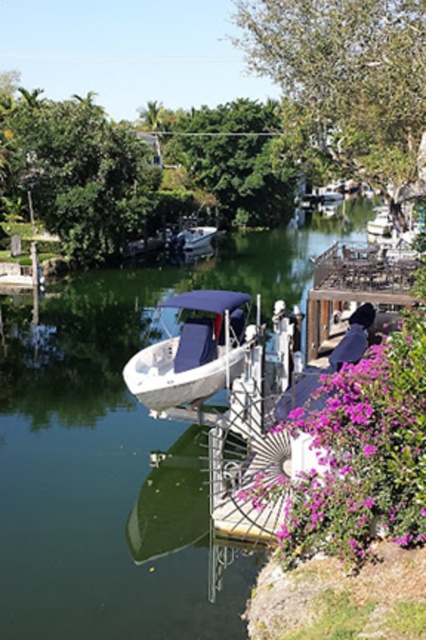
Who is more forward, [304,292] or [173,378]?

Positioned in front is point [173,378].

Identify the location of green smooth water at center. This screenshot has width=426, height=640. (120, 452).

This screenshot has width=426, height=640. Identify the location of green smooth water at center. (120, 452).

Is purple matte flower at lower right taller than white matte boat at center?

Yes.

Which is more to the right, purple matte flower at lower right or white matte boat at center?

purple matte flower at lower right

Find the location of a particular element. The image size is (426, 640). purple matte flower at lower right is located at coordinates (359, 454).

This screenshot has width=426, height=640. What do you see at coordinates (120, 452) in the screenshot? I see `green smooth water at center` at bounding box center [120, 452].

Does green smooth water at center have a larger size compared to purple matte flower at lower right?

Yes, green smooth water at center is bigger than purple matte flower at lower right.

Between point (118, 611) and point (385, 360), which one is positioned in front?

Point (385, 360) is more forward.

Identify the location of green smooth water at center. (120, 452).